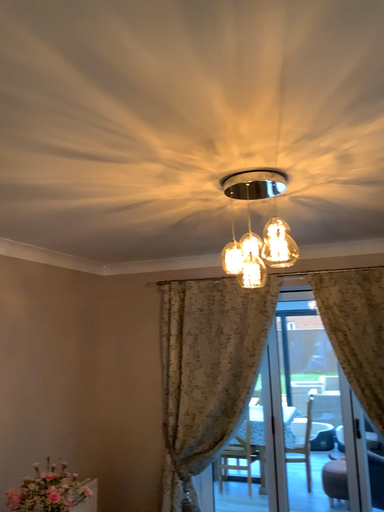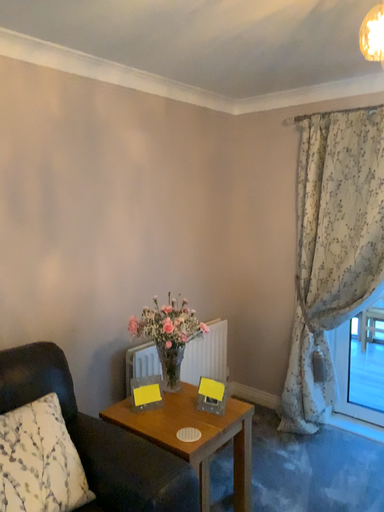
Question: How did the camera likely rotate when shooting the video?

Choices:
 (A) rotated upward
 (B) rotated downward

Answer: (B)